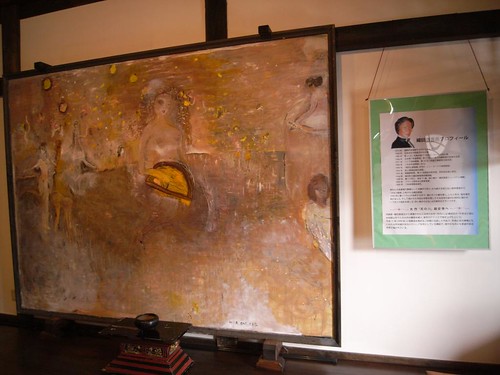
Where is `brown paint`? The height and width of the screenshot is (375, 500). brown paint is located at coordinates (317, 180).